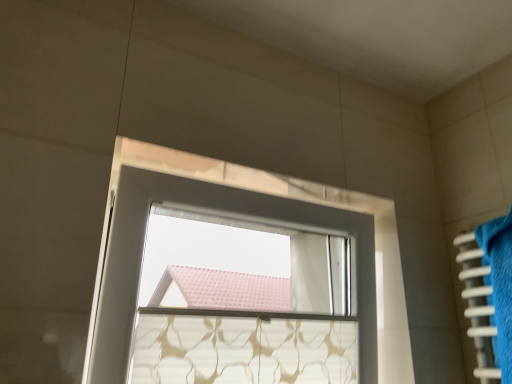
The width and height of the screenshot is (512, 384). I want to click on white plastic window at center, so click(217, 213).

Image resolution: width=512 pixels, height=384 pixels. What do you see at coordinates (217, 213) in the screenshot?
I see `white plastic window at center` at bounding box center [217, 213].

This screenshot has height=384, width=512. In order to click on white plastic window at center in this screenshot , I will do `click(217, 213)`.